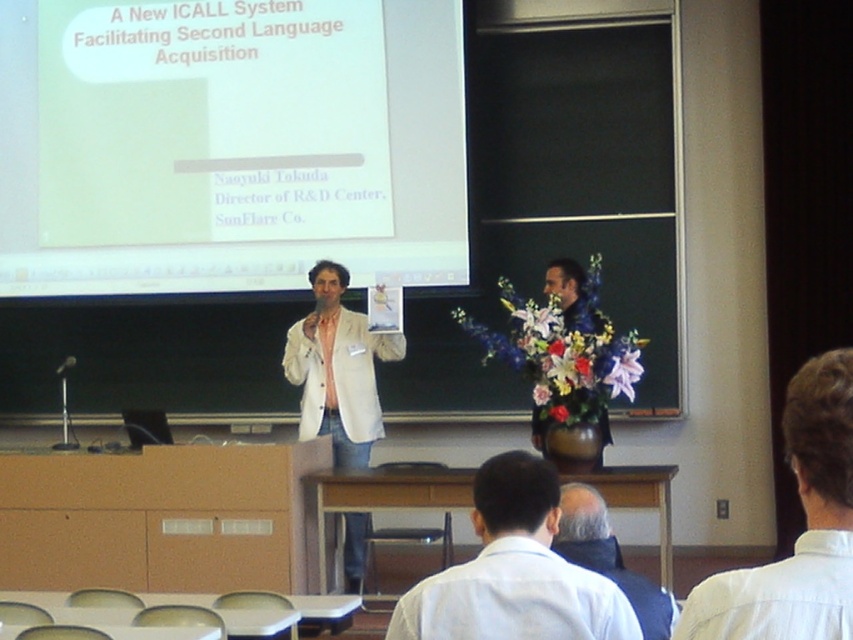
The height and width of the screenshot is (640, 853). What do you see at coordinates (514, 572) in the screenshot? I see `white shirt at lower center` at bounding box center [514, 572].

Who is positioned more to the right, white shirt at lower center or white matte lab coat at center?

Positioned to the right is white shirt at lower center.

Locate an element on the screen. The width and height of the screenshot is (853, 640). white shirt at lower center is located at coordinates (514, 572).

This screenshot has height=640, width=853. Find the location of `white shirt at lower center`. white shirt at lower center is located at coordinates tap(514, 572).

Can you confirm if white matte projector screen at upper center is smaller than dark blue jacket at lower center?

No.

Does point (79, 54) lie in front of point (596, 556)?

No, it is not.

Which is in front, point (175, 68) or point (550, 545)?

Point (550, 545) is in front.

Find the location of a particular element. This screenshot has height=640, width=853. white matte projector screen at upper center is located at coordinates (228, 144).

Consider the image. Does white matte projector screen at upper center have a lesser height compared to white shirt at lower right?

No, white matte projector screen at upper center is not shorter than white shirt at lower right.

From the picture: Who is taller, white matte projector screen at upper center or white shirt at lower right?

white matte projector screen at upper center

Which is in front, point (177, 164) or point (785, 417)?

Point (785, 417) is more forward.

Where is `white matte projector screen at upper center`? The width and height of the screenshot is (853, 640). white matte projector screen at upper center is located at coordinates (228, 144).